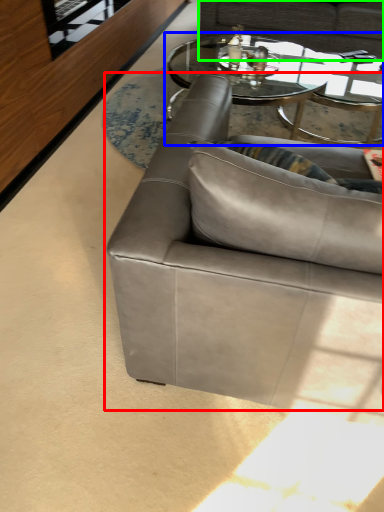
Question: Which object is the closest to the studio couch (highlighted by a red box)? Choose among these: coffee table (highlighted by a blue box) or studio couch (highlighted by a green box).

Choices:
 (A) coffee table
 (B) studio couch

Answer: (A)